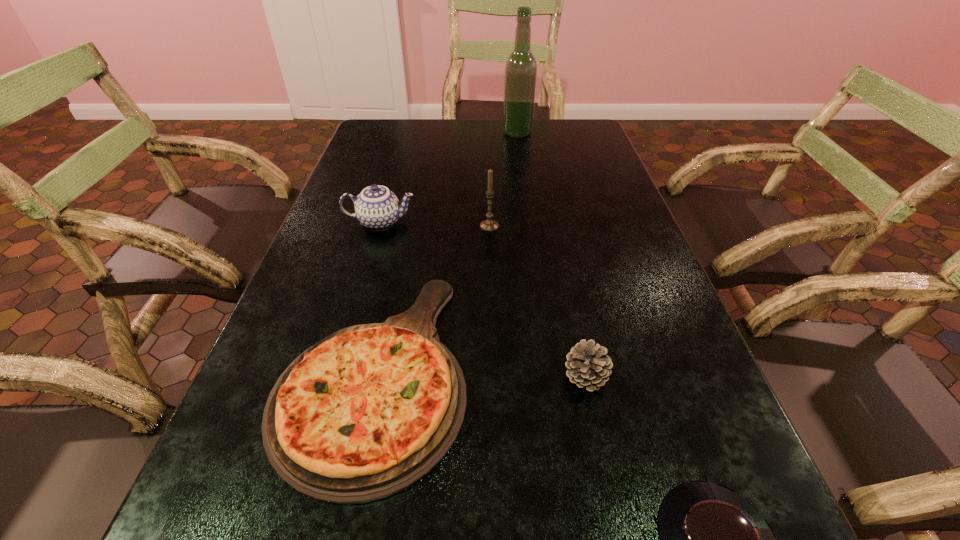
Identify the location of free spot between the pinecone and the farthest object. This screenshot has height=540, width=960. (551, 254).

I want to click on vacant space in between the fourth tallest object and the liquor, so click(x=551, y=254).

Find the location of a particular element. The height and width of the screenshot is (540, 960). vacant point located between the chinaware and the third object from left to right is located at coordinates (435, 224).

The width and height of the screenshot is (960, 540). I want to click on blank region between the fourth tallest object and the tallest object, so click(x=551, y=254).

Image resolution: width=960 pixels, height=540 pixels. Identify the location of vacant space that's between the pizza and the chinaware. (377, 296).

Where is `free point between the chinaware and the fifth shortest object`? This screenshot has width=960, height=540. free point between the chinaware and the fifth shortest object is located at coordinates (435, 224).

You are a GUI agent. You are given a task and a screenshot of the screen. Output one action in this format:
    pyautogui.click(x=<x>, y=<y>)
    Task: Click on the object that is the third closest to the pinecone
    The image size is (960, 540).
    Given the screenshot: What is the action you would take?
    pyautogui.click(x=487, y=225)

I want to click on the fourth closest object to the farthest object, so [588, 366].

This screenshot has width=960, height=540. What are the coordinates of `free space that satisfies the following two spatial constraints: 1. from the spout of the chinaware; 2. on the back side of the third shortest object` in the screenshot? It's located at pyautogui.click(x=336, y=376).

Where is `blank space that satisfies the following two spatial constraints: 1. from the spout of the fourth object from right to left; 2. on the left side of the chinaware`? blank space that satisfies the following two spatial constraints: 1. from the spout of the fourth object from right to left; 2. on the left side of the chinaware is located at coordinates (379, 226).